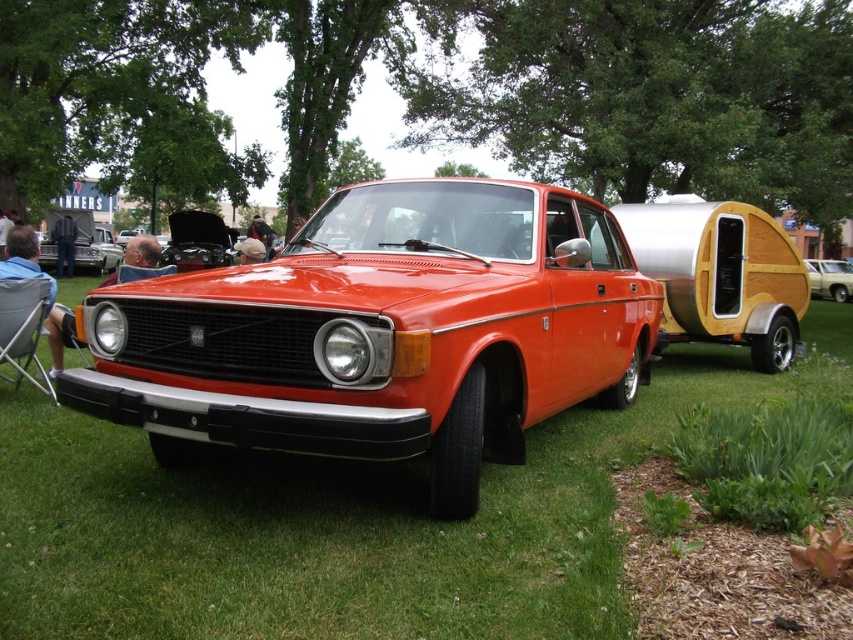
You are standing at a car show and want to take a photo of the metallic gold car at center. If your camera has a maximum focus range of 30 feet, will you need to move closer to get a clear shot?

The metallic gold car at center is 33.53 feet away from the viewer. Since the camera can only focus up to 30 feet, you need to move closer to ensure the metallic gold car at center is within the camera range.

You are a photographer setting up a tripod to capture the wooden trailer at right and the blue denim jeans at lower left. Based on their heights, which object should you adjust the camera angle upwards to focus on?

The wooden trailer at right is much taller than the blue denim jeans at lower left, so you should adjust the camera angle upwards to focus on the wooden trailer at right.

Consider the image. You are a photographer planning to take a photo of the matte black car at center. You want to ensure the green grass at center is visible in the background. Based on their heights, will the grass be visible behind the car?

The green grass at center is not as tall as the matte black car at center, so the grass will be visible behind the car since it is shorter.